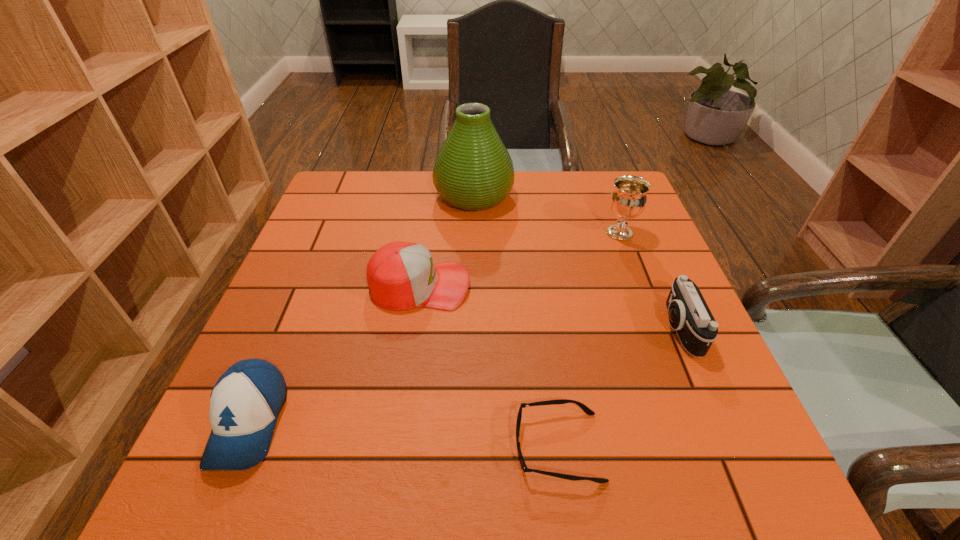
I want to click on the tallest object, so click(473, 171).

Find the location of `vase`. vase is located at coordinates (473, 171).

The width and height of the screenshot is (960, 540). What are the coordinates of `chalice` in the screenshot? It's located at (628, 199).

Locate an element on the screen. The height and width of the screenshot is (540, 960). the second tallest object is located at coordinates (628, 199).

Where is `the farther baseball cap`? The width and height of the screenshot is (960, 540). the farther baseball cap is located at coordinates (401, 275).

The image size is (960, 540). In order to click on camera in this screenshot , I will do `click(689, 315)`.

This screenshot has height=540, width=960. Identify the location of the nearer baseball cap. (245, 402).

The height and width of the screenshot is (540, 960). What are the coordinates of `the left baseball cap` in the screenshot? It's located at (245, 402).

What are the coordinates of `the shortest object` in the screenshot? It's located at (587, 410).

In order to click on vacant space located 0.200m on the right of the vase in this screenshot , I will do `click(581, 195)`.